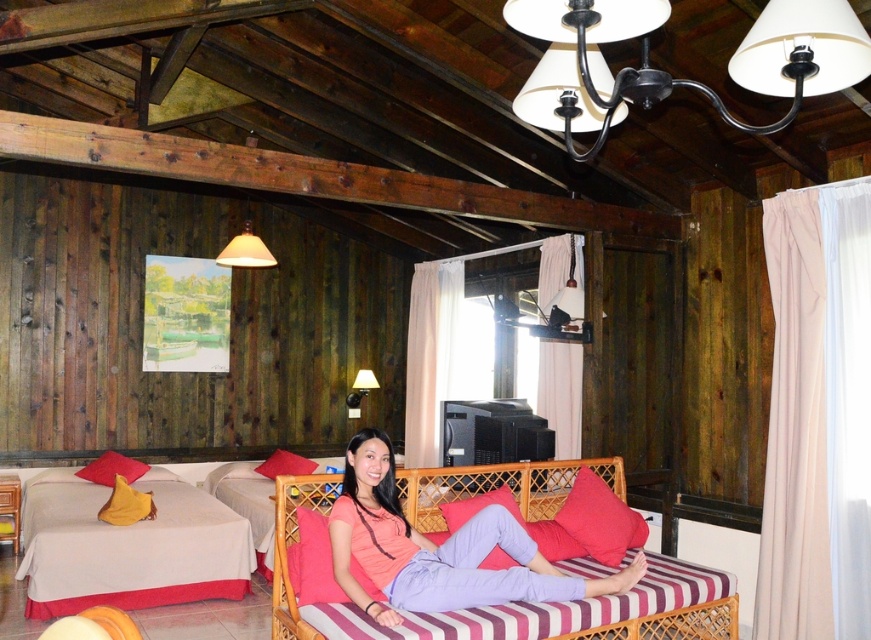
The width and height of the screenshot is (871, 640). Describe the element at coordinates (112, 468) in the screenshot. I see `matte red pillow at lower left` at that location.

Does point (125, 460) come farther from viewer compared to point (294, 464)?

No, it is in front of (294, 464).

Between point (140, 474) and point (278, 472), which one is positioned in front?

Point (140, 474) is in front.

This screenshot has height=640, width=871. What are the coordinates of `matte red pillow at lower left` in the screenshot? It's located at (112, 468).

Is matte red cushion at center thinner than matte black wall lamp at upper center?

No, matte red cushion at center is not thinner than matte black wall lamp at upper center.

This screenshot has width=871, height=640. I want to click on matte red cushion at center, so click(599, 518).

Who is positioned more to the left, matte red cushion at center or red cotton pillow at center?

From the viewer's perspective, red cotton pillow at center appears more on the left side.

Does point (604, 528) come closer to viewer compared to point (294, 474)?

No, it is behind (294, 474).

Locate an element on the screen. This screenshot has height=640, width=871. matte red cushion at center is located at coordinates (599, 518).